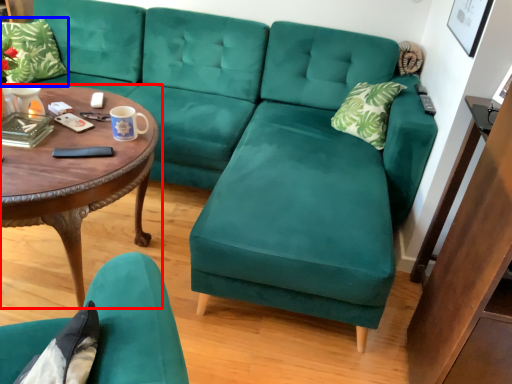
Question: Which object appears farthest to the camera in this image, coffee table (highlighted by a red box) or pillow (highlighted by a blue box)?

Choices:
 (A) coffee table
 (B) pillow

Answer: (B)